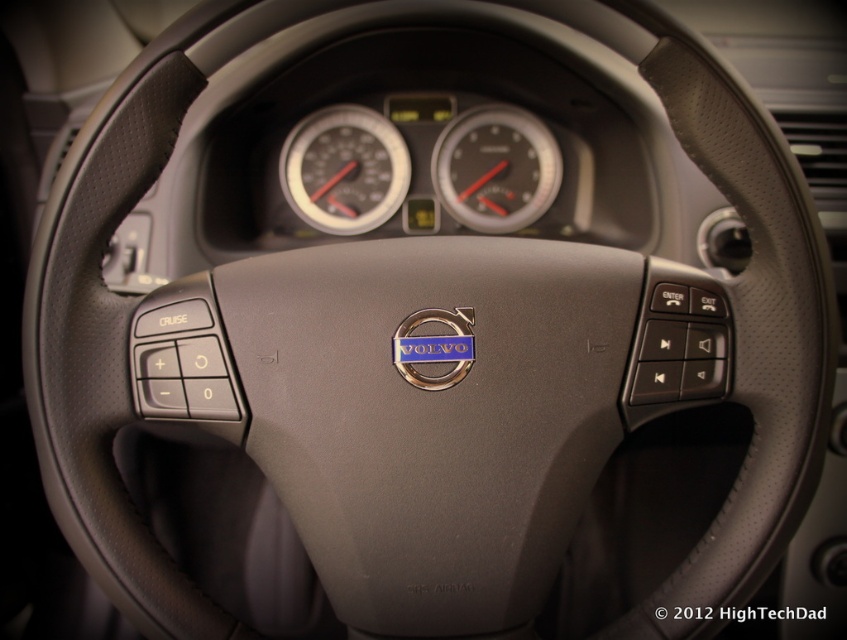
Question: Which point is farther from the camera taking this photo?

Choices:
 (A) (314, 202)
 (B) (524, 189)

Answer: (A)

Question: Is matte black speedometer at center above black plastic speedometer at center?

Choices:
 (A) yes
 (B) no

Answer: (A)

Question: Which point is closer to the camera?

Choices:
 (A) (549, 196)
 (B) (339, 200)

Answer: (A)

Question: Does matte black speedometer at center appear on the left side of black plastic speedometer at center?

Choices:
 (A) no
 (B) yes

Answer: (B)

Question: Does matte black speedometer at center have a smaller size compared to black plastic speedometer at center?

Choices:
 (A) no
 (B) yes

Answer: (B)